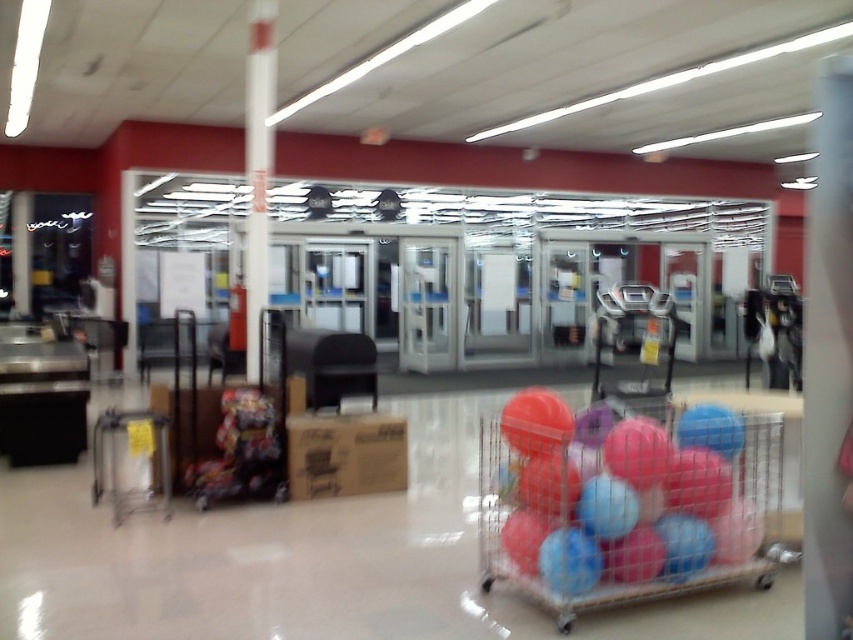
You are a customer in the store and want to pick up the rubberized plastic ball at center and the white glossy pole at center. Which object should you reach for first to avoid knocking over the other?

You should reach for the rubberized plastic ball at center first because it is closer to you than the white glossy pole at center, so grabbing it first would prevent disturbing the pole.

You are a store employee who needs to place a new item on the shelf. You have a rubberized plastic ball at center and a white glossy pole at center. Which item requires a larger storage space?

The rubberized plastic ball at center requires a larger storage space because it is larger in size than the white glossy pole at center.

You are standing at the entrance of the store and see the rubberized plastic ball at center. If you walk straight ahead, will you reach the ball before reaching the trash bin?

The position of the rubberized plastic ball at center is at point (624, 499). Since the trash bin is not mentioned in the objects description, it is impossible to determine the relative positions. Therefore, I cannot answer whether you will reach the ball before the trash bin.